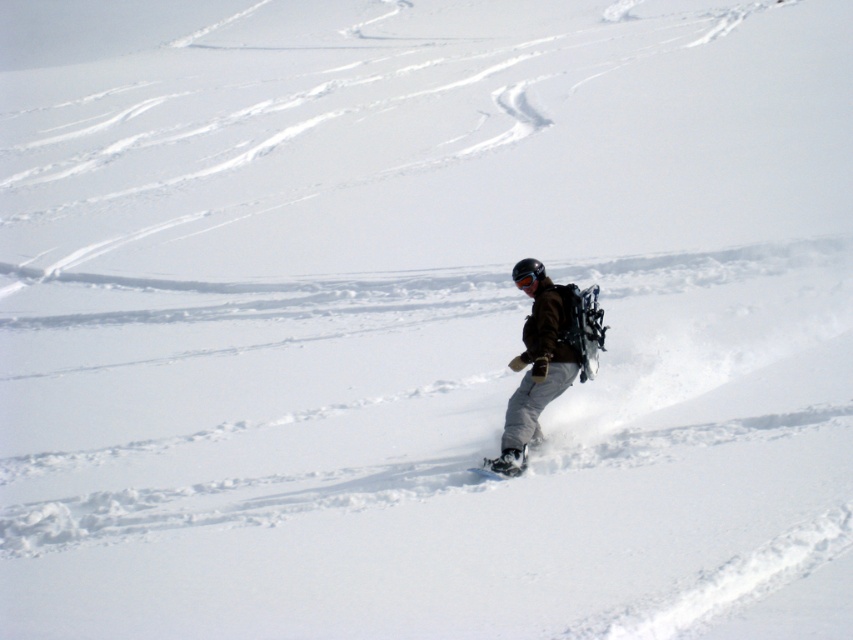
Question: Is dark brown jacket at center closer to the viewer compared to white matte snowboard at center?

Choices:
 (A) yes
 (B) no

Answer: (B)

Question: From the image, what is the correct spatial relationship of dark brown jacket at center in relation to white matte snowboard at center?

Choices:
 (A) right
 (B) left

Answer: (A)

Question: Which point is farther from the camera taking this photo?

Choices:
 (A) (x=485, y=461)
 (B) (x=552, y=371)

Answer: (B)

Question: Which of the following is the closest to the observer?

Choices:
 (A) dark brown jacket at center
 (B) white matte snowboard at center

Answer: (B)

Question: Which point is farther from the camera taking this photo?

Choices:
 (A) pyautogui.click(x=560, y=296)
 (B) pyautogui.click(x=521, y=465)

Answer: (A)

Question: Is dark brown jacket at center above white matte snowboard at center?

Choices:
 (A) no
 (B) yes

Answer: (B)